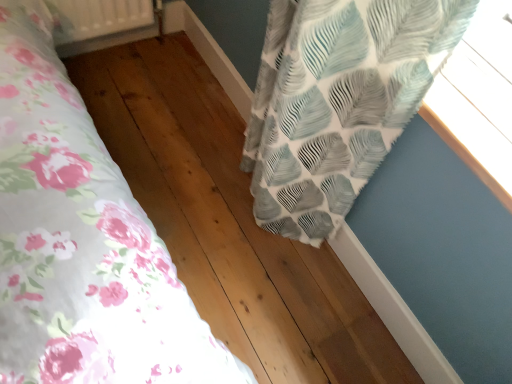
Question: Is textured fabric curtain at upper right at the right side of textured white and blue leaf-patterned curtain at upper right?

Choices:
 (A) no
 (B) yes

Answer: (B)

Question: Considering the relative sizes of textured fabric curtain at upper right and textured white and blue leaf-patterned curtain at upper right in the image provided, is textured fabric curtain at upper right thinner than textured white and blue leaf-patterned curtain at upper right?

Choices:
 (A) yes
 (B) no

Answer: (B)

Question: Are textured fabric curtain at upper right and textured white and blue leaf-patterned curtain at upper right making contact?

Choices:
 (A) yes
 (B) no

Answer: (B)

Question: Does textured fabric curtain at upper right have a smaller size compared to textured white and blue leaf-patterned curtain at upper right?

Choices:
 (A) yes
 (B) no

Answer: (B)

Question: Does textured fabric curtain at upper right appear on the left side of textured white and blue leaf-patterned curtain at upper right?

Choices:
 (A) no
 (B) yes

Answer: (A)

Question: Are textured fabric curtain at upper right and textured white and blue leaf-patterned curtain at upper right far apart?

Choices:
 (A) no
 (B) yes

Answer: (A)

Question: From a real-world perspective, is white plastic radiator at upper left located beneath textured white and blue leaf-patterned curtain at upper right?

Choices:
 (A) yes
 (B) no

Answer: (A)

Question: Can you confirm if white plastic radiator at upper left is bigger than textured white and blue leaf-patterned curtain at upper right?

Choices:
 (A) no
 (B) yes

Answer: (A)

Question: From the image's perspective, is white plastic radiator at upper left above textured white and blue leaf-patterned curtain at upper right?

Choices:
 (A) no
 (B) yes

Answer: (B)

Question: Considering the relative sizes of white plastic radiator at upper left and textured white and blue leaf-patterned curtain at upper right in the image provided, is white plastic radiator at upper left thinner than textured white and blue leaf-patterned curtain at upper right?

Choices:
 (A) no
 (B) yes

Answer: (A)

Question: Can you confirm if white plastic radiator at upper left is shorter than textured white and blue leaf-patterned curtain at upper right?

Choices:
 (A) no
 (B) yes

Answer: (B)

Question: From a real-world perspective, is white plastic radiator at upper left physically above textured white and blue leaf-patterned curtain at upper right?

Choices:
 (A) yes
 (B) no

Answer: (B)

Question: From the image's perspective, is white plastic radiator at upper left above textured fabric curtain at upper right?

Choices:
 (A) no
 (B) yes

Answer: (B)